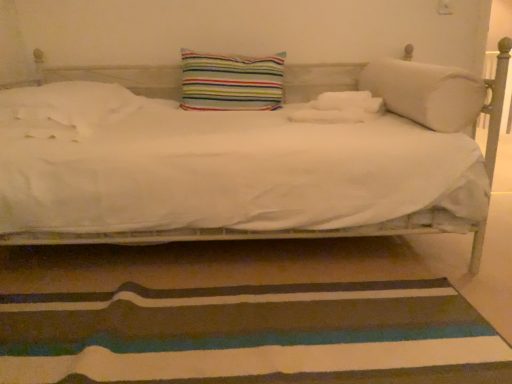
At what (x,y) coordinates should I click in order to perform the action: click on vacant region below striped fabric doormat at lower center (from a real-world perspective). Please return your answer as a coordinate pair (x, y). Looking at the image, I should click on (272, 340).